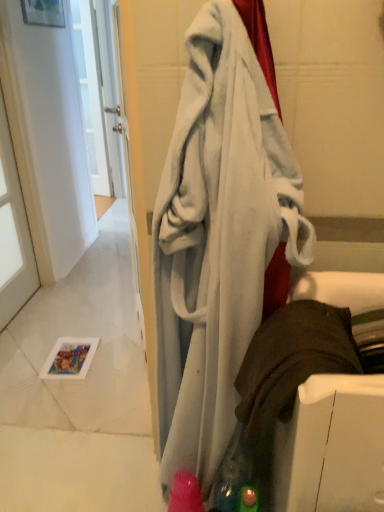
Question: Does transparent glass door at left appear on the right side of soft white towel at center?

Choices:
 (A) no
 (B) yes

Answer: (A)

Question: From the image's perspective, is transparent glass door at left below soft white towel at center?

Choices:
 (A) no
 (B) yes

Answer: (A)

Question: Is soft white towel at center a part of transparent glass door at left?

Choices:
 (A) no
 (B) yes

Answer: (A)

Question: Considering the relative positions of transparent glass door at left and soft white towel at center in the image provided, is transparent glass door at left to the left of soft white towel at center from the viewer's perspective?

Choices:
 (A) no
 (B) yes

Answer: (B)

Question: Is transparent glass door at left positioned before soft white towel at center?

Choices:
 (A) yes
 (B) no

Answer: (B)

Question: From the image's perspective, is transparent glass door at left on soft white towel at center?

Choices:
 (A) yes
 (B) no

Answer: (A)

Question: From a real-world perspective, is soft white towel at center below transparent glass door at left?

Choices:
 (A) no
 (B) yes

Answer: (A)

Question: Considering the relative sizes of soft white towel at center and transparent glass door at left in the image provided, is soft white towel at center shorter than transparent glass door at left?

Choices:
 (A) yes
 (B) no

Answer: (A)

Question: From a real-world perspective, is soft white towel at center over transparent glass door at left?

Choices:
 (A) yes
 (B) no

Answer: (A)

Question: Can you confirm if soft white towel at center is smaller than transparent glass door at left?

Choices:
 (A) no
 (B) yes

Answer: (A)

Question: Is soft white towel at center outside of transparent glass door at left?

Choices:
 (A) no
 (B) yes

Answer: (B)

Question: From the image's perspective, is soft white towel at center below transparent glass door at left?

Choices:
 (A) no
 (B) yes

Answer: (B)

Question: Looking at the image, does soft white towel at center seem bigger or smaller compared to transparent glass door at left?

Choices:
 (A) small
 (B) big

Answer: (B)